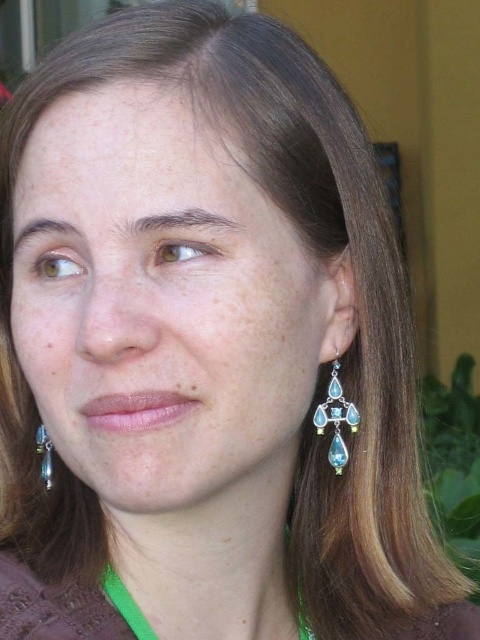
Question: Which of the following is the farthest from the observer?

Choices:
 (A) shiny silver earrings at right
 (B) shiny silver earring at lower left

Answer: (B)

Question: Which of the following is the closest to the observer?

Choices:
 (A) shiny silver earrings at right
 (B) shiny silver earring at lower left

Answer: (A)

Question: Does shiny silver earrings at right come in front of shiny silver earring at lower left?

Choices:
 (A) no
 (B) yes

Answer: (B)

Question: Considering the relative positions of shiny silver earrings at right and shiny silver earring at lower left in the image provided, where is shiny silver earrings at right located with respect to shiny silver earring at lower left?

Choices:
 (A) right
 (B) left

Answer: (A)

Question: Which point is farther from the camera taking this photo?

Choices:
 (A) (336, 444)
 (B) (41, 445)

Answer: (B)

Question: Can you confirm if shiny silver earrings at right is thinner than shiny silver earring at lower left?

Choices:
 (A) yes
 (B) no

Answer: (B)